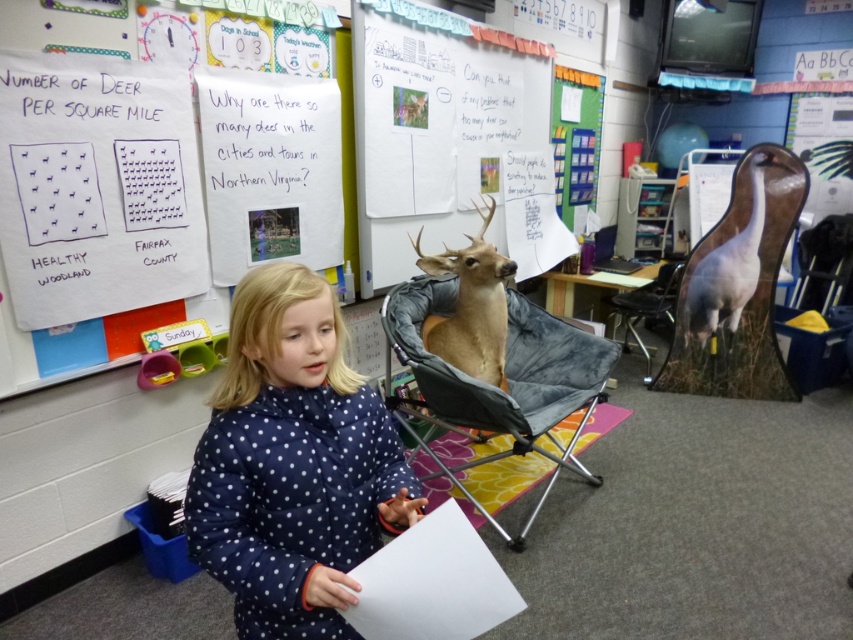
The image size is (853, 640). In order to click on navy polka dot coat at center in this screenshot , I will do `click(292, 461)`.

Is navy polka dot coat at center thinner than whiteboard at upper center?

Yes.

What do you see at coordinates (292, 461) in the screenshot? This screenshot has height=640, width=853. I see `navy polka dot coat at center` at bounding box center [292, 461].

Where is `navy polka dot coat at center`? The image size is (853, 640). navy polka dot coat at center is located at coordinates (292, 461).

Is whiteboard at upper center taller than gray fabric folding chair at center?

Yes, whiteboard at upper center is taller than gray fabric folding chair at center.

Is whiteboard at upper center further to camera compared to gray fabric folding chair at center?

Yes, whiteboard at upper center is further from the viewer.

Does point (506, 131) come farther from viewer compared to point (495, 460)?

Yes, it is.

The height and width of the screenshot is (640, 853). Find the location of `whiteboard at upper center`. whiteboard at upper center is located at coordinates (434, 131).

Is navy polka dot coat at center bigger than gray fabric folding chair at center?

Incorrect, navy polka dot coat at center is not larger than gray fabric folding chair at center.

Measure the distance between navy polka dot coat at center and gray fabric folding chair at center.

navy polka dot coat at center and gray fabric folding chair at center are 1.34 meters apart from each other.

Measure the distance between point (228, 356) and camera.

1.28 meters

This screenshot has width=853, height=640. I want to click on navy polka dot coat at center, so click(x=292, y=461).